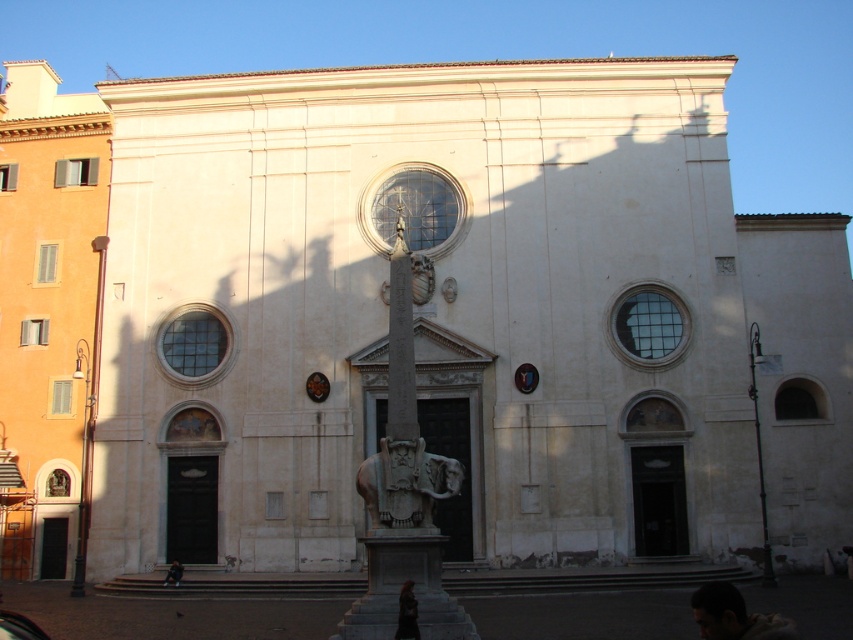
You are an architect examining the building facade. You notice the carved stone elephant at center and the dark hair human head at lower right. Which of these two elements has a smaller width?

The carved stone elephant at center has a lesser width compared to the dark hair human head at lower right.

You are an architect analyzing the symmetry of the building. The point marked at coordinates [405,483] is part of a carved stone elephant at the center. Given the building is symmetrical, where would you expect to find another carved stone elephant?

Since the building is symmetrical and the carved stone elephant at center is marked at point [405,483], another carved stone elephant would be mirrored across the central axis, likely at coordinates 0.245, 0.476.